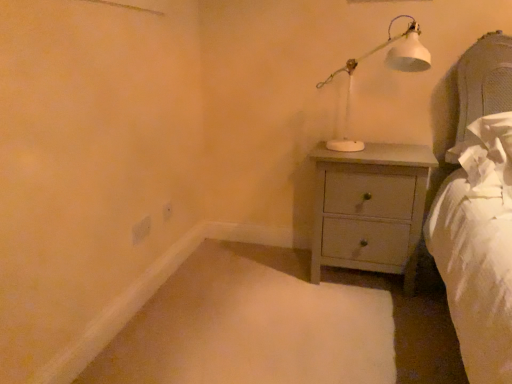
The width and height of the screenshot is (512, 384). Identify the location of vacant space underneath white matte table lamp at upper right (from a real-world perspective). (364, 154).